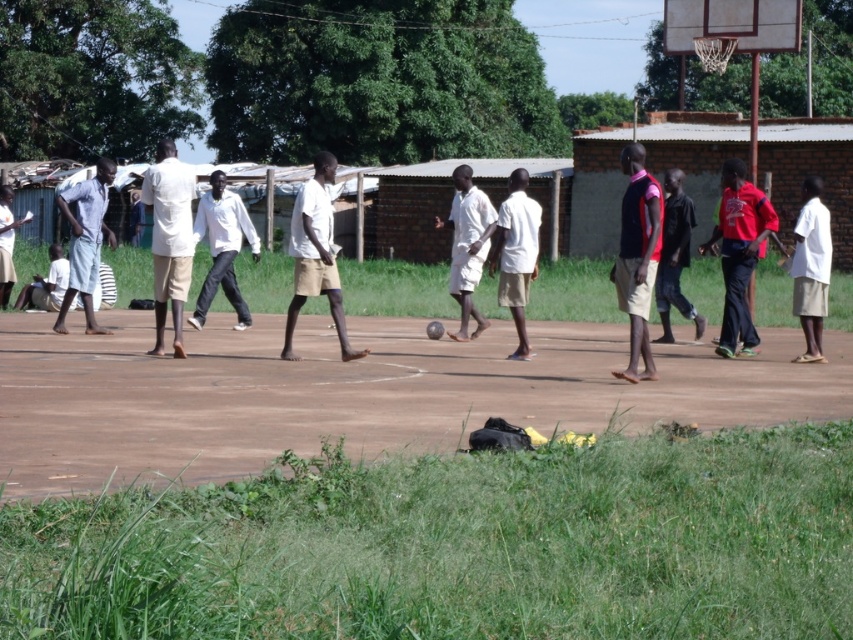
Where is the red matte shirt at right located in the image?

Answer: The red matte shirt at right is located at point (740, 253) in the image.

You are a photographer standing at the edge of the basketball court. You need to position yourself so that both the white matte shirt at center and the dark red shirt at center are visible in your shot. Based on their positions, which shirt should you focus on first to ensure both are in frame?

You should focus on the white matte shirt at center first since it is positioned to the left of the dark red shirt at center, allowing you to frame both by adjusting your angle to include both left and right sides of the scene.